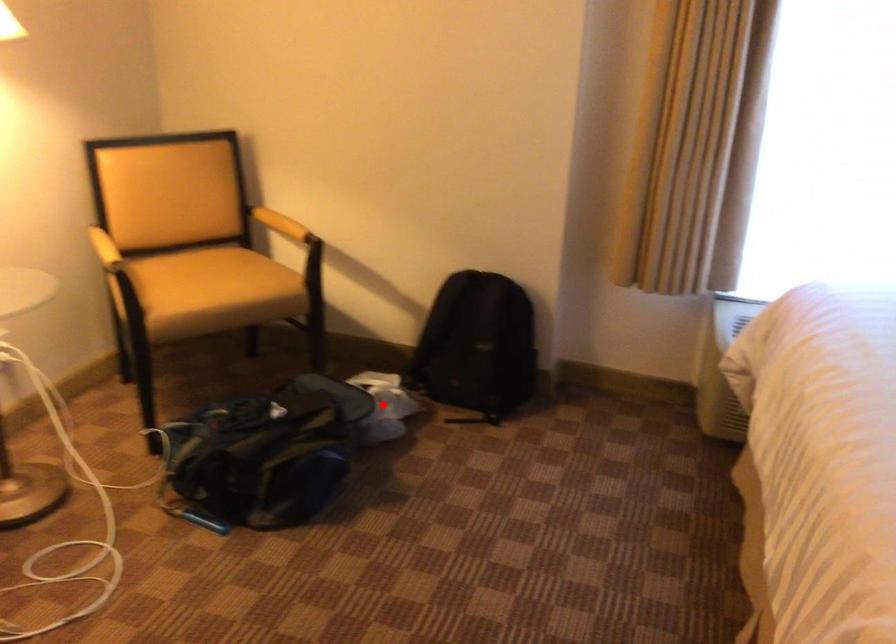
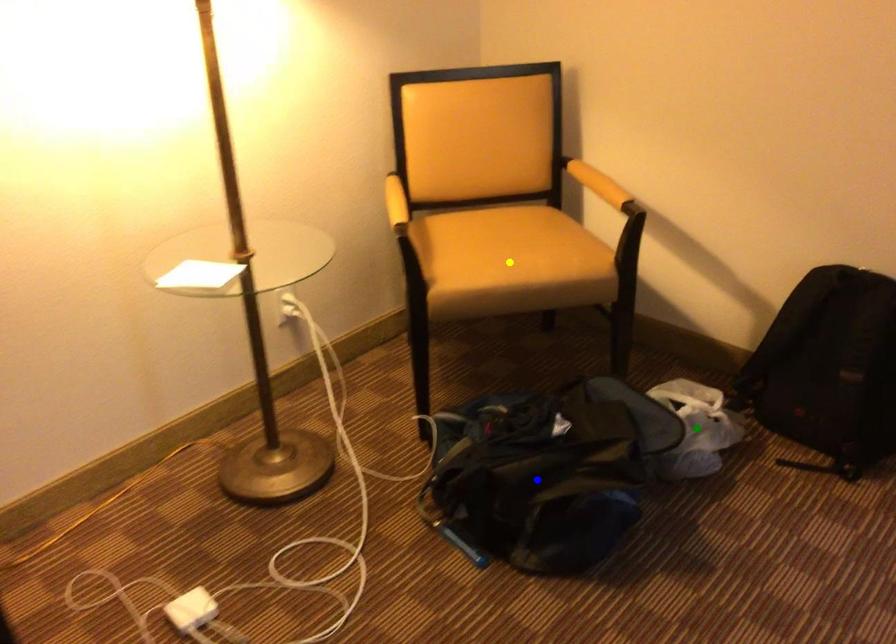
Question: I am providing you with two images of the same scene from different viewpoints. A red point is marked on the first image. You are given multiple points on the second image. In image 2, which mark is for the same physical point as the one in image 1?

Choices:
 (A) green point
 (B) yellow point
 (C) blue point

Answer: (A)